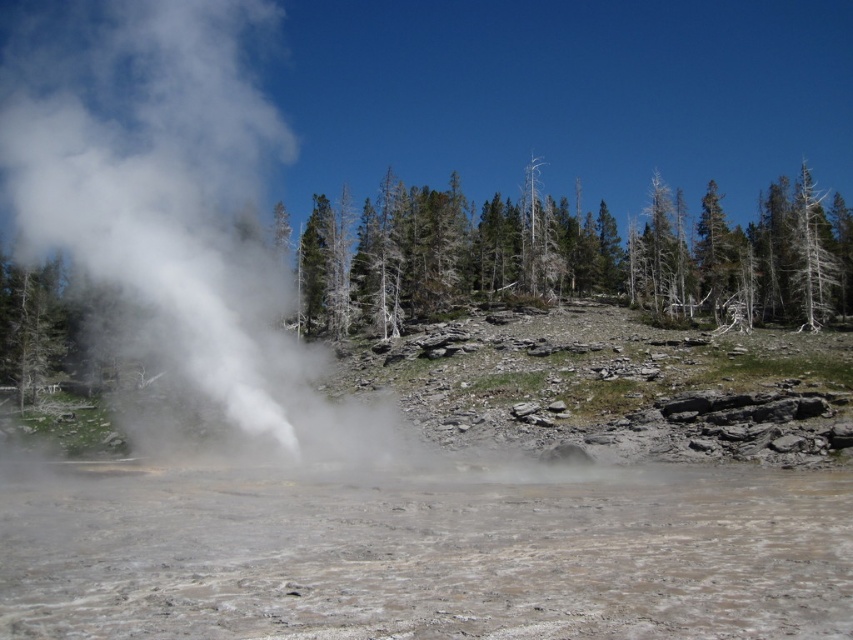
Question: Estimate the real-world distances between objects in this image. Which object is farther from the muddy water at center?

Choices:
 (A) dead wood trees at center
 (B) white vapor at center

Answer: (A)

Question: Is white vapor at center behind dead wood trees at center?

Choices:
 (A) no
 (B) yes

Answer: (A)

Question: Where is muddy water at center located in relation to white vapor at center in the image?

Choices:
 (A) right
 (B) left

Answer: (A)

Question: Which point appears closest to the camera in this image?

Choices:
 (A) (393, 269)
 (B) (566, 518)
 (C) (140, 237)

Answer: (B)

Question: Does muddy water at center appear on the left side of white vapor at center?

Choices:
 (A) yes
 (B) no

Answer: (B)

Question: Which object is closer to the camera taking this photo?

Choices:
 (A) dead wood trees at center
 (B) white vapor at center

Answer: (B)